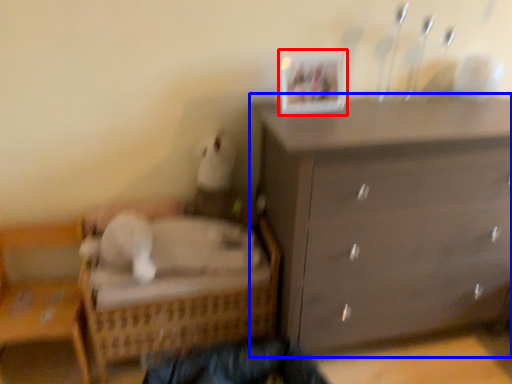
Question: Which of the following is the closest to the observer, picture frame (highlighted by a red box) or chest of drawers (highlighted by a blue box)?

Choices:
 (A) picture frame
 (B) chest of drawers

Answer: (B)